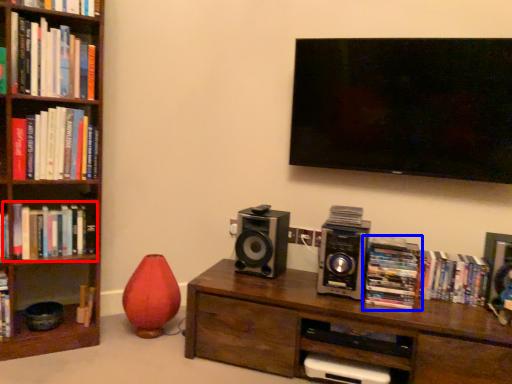
Question: Among these objects, which one is nearest to the camera, book (highlighted by a red box) or book (highlighted by a blue box)?

Choices:
 (A) book
 (B) book

Answer: (B)